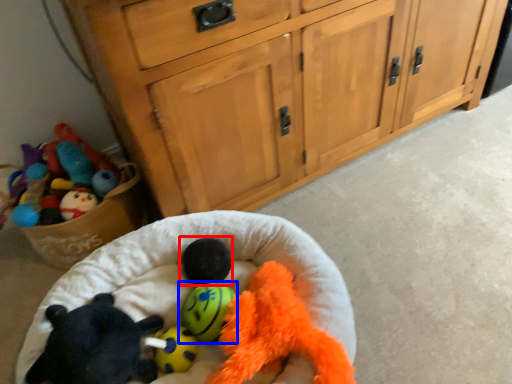
Question: Which of the following is the closest to the observer, animal (highlighted by a red box) or toy (highlighted by a blue box)?

Choices:
 (A) animal
 (B) toy

Answer: (B)